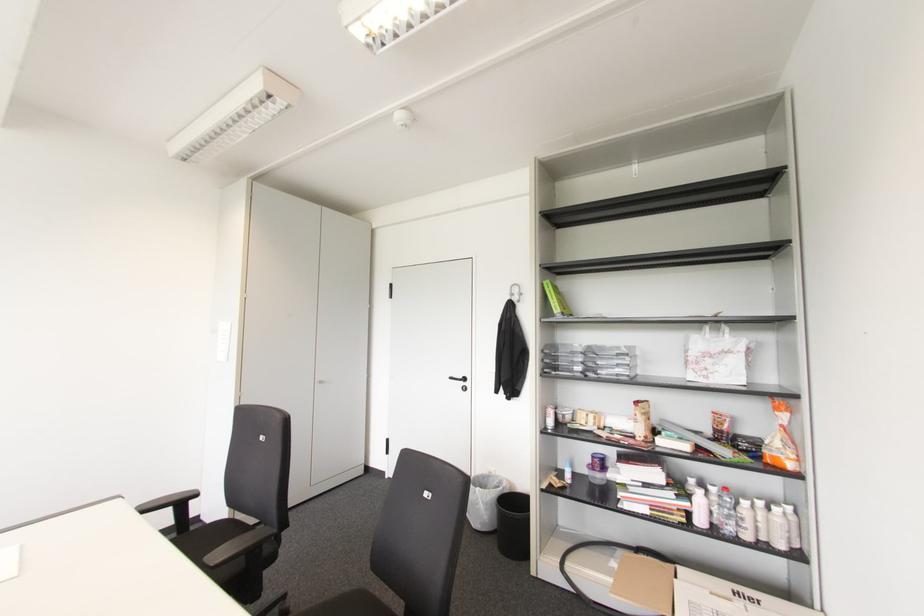
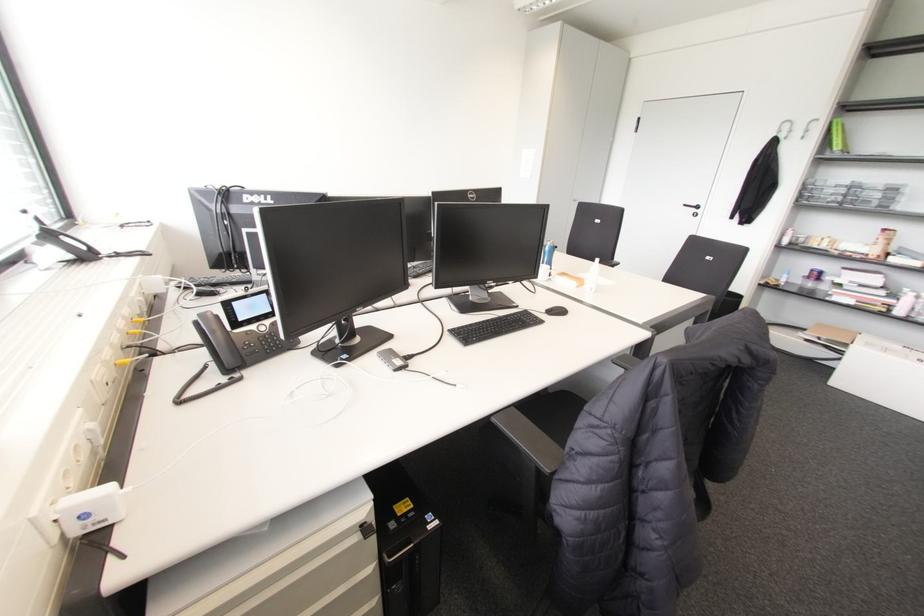
In the second image, find the point that corresponds to point 464,379 in the first image.

(697, 207)